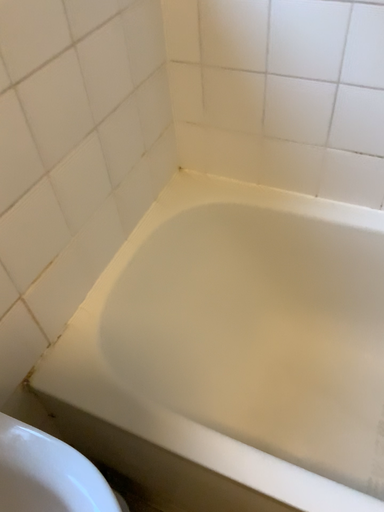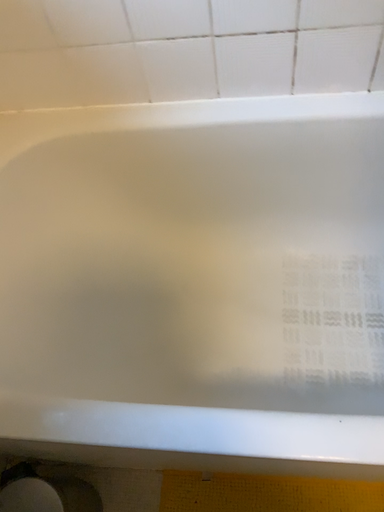
Question: How did the camera likely rotate when shooting the video?

Choices:
 (A) rotated downward
 (B) rotated upward

Answer: (A)